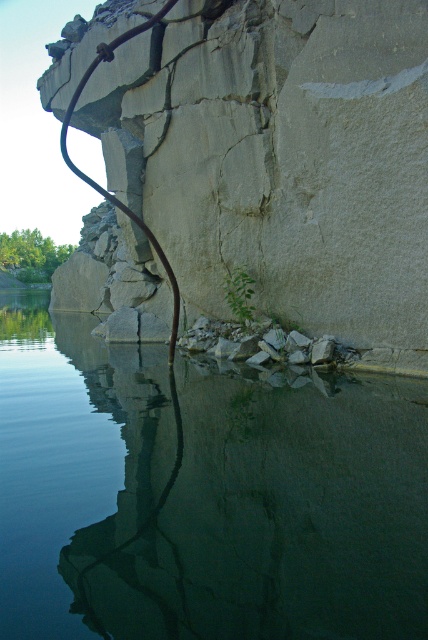
Who is positioned more to the right, clear water at center or smooth concrete cliff at center?

Positioned to the right is clear water at center.

Which is above, clear water at center or smooth concrete cliff at center?

smooth concrete cliff at center is above.

Is point (306, 614) farther from viewer compared to point (190, 1)?

No, (306, 614) is in front of (190, 1).

This screenshot has width=428, height=640. In order to click on clear water at center in this screenshot , I will do `click(202, 493)`.